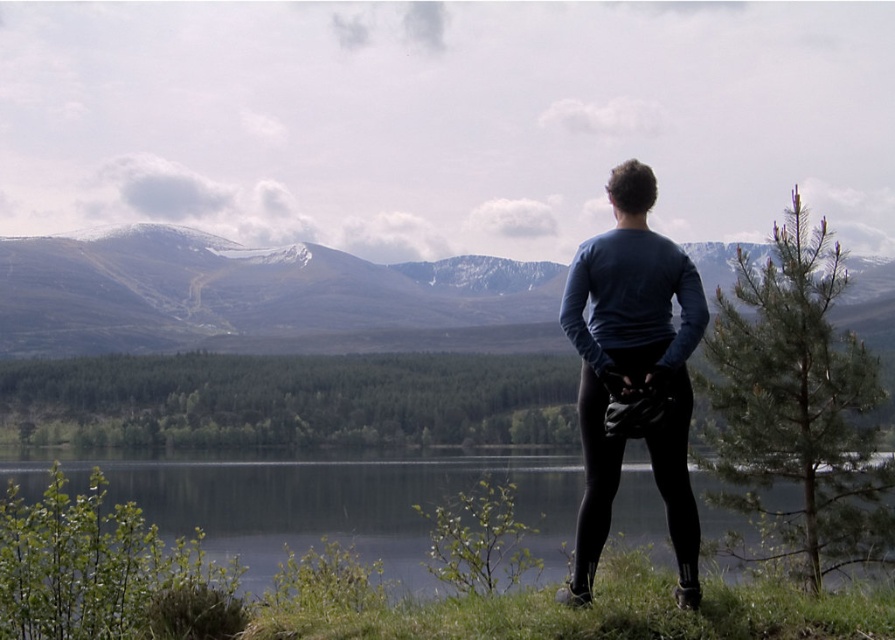
What do you see at coordinates (334, 506) in the screenshot? I see `green grass at lower center` at bounding box center [334, 506].

Which is behind, point (345, 509) or point (671, 458)?

The point (345, 509) is behind.

Is point (560, 531) more distant than point (623, 188)?

Yes, it is behind point (623, 188).

Locate an element on the screen. This screenshot has width=895, height=640. green grass at lower center is located at coordinates (334, 506).

Who is positioned more to the right, sandy brown mountain at center or dark blue long-sleeve shirt at center?

From the viewer's perspective, dark blue long-sleeve shirt at center appears more on the right side.

Which is in front, point (28, 308) or point (674, 381)?

Point (674, 381)

Identify the location of sandy brown mountain at center. The height and width of the screenshot is (640, 895). (243, 291).

Can you confirm if sandy brown mountain at center is thinner than green grass at lower center?

No, sandy brown mountain at center is not thinner than green grass at lower center.

Does sandy brown mountain at center lie in front of green grass at lower center?

No, sandy brown mountain at center is further to the viewer.

The height and width of the screenshot is (640, 895). Find the location of `sandy brown mountain at center`. sandy brown mountain at center is located at coordinates click(243, 291).